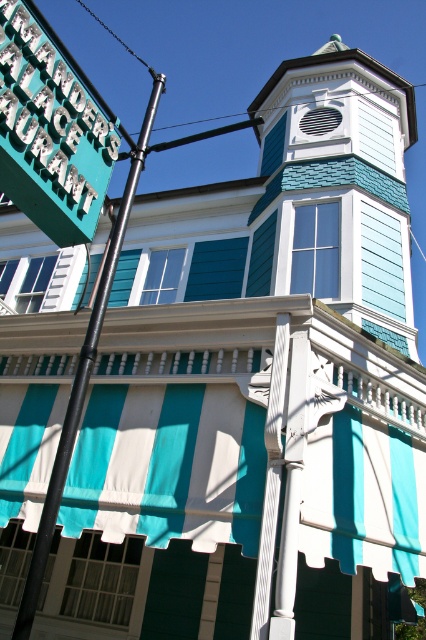
Which of these two, white shingled bell tower at upper center or black metal pole at left, stands shorter?

white shingled bell tower at upper center is shorter.

In order to click on white shingled bell tower at upper center in this screenshot , I will do `click(344, 180)`.

Does point (9, 13) come farther from viewer compared to point (118, 250)?

No, (9, 13) is closer to viewer.

Can you confirm if teal plastic sign at upper left is positioned to the left of black metal pole at left?

Incorrect, teal plastic sign at upper left is not on the left side of black metal pole at left.

Who is more distant from viewer, (32, 28) or (120, 204)?

Positioned behind is point (120, 204).

Locate an element on the screen. The width and height of the screenshot is (426, 640). teal plastic sign at upper left is located at coordinates (49, 132).

Is white shingled bell tower at upper center shorter than teal plastic sign at upper left?

No, white shingled bell tower at upper center is not shorter than teal plastic sign at upper left.

Is white shingled bell tower at upper center to the right of teal plastic sign at upper left from the viewer's perspective?

Yes, white shingled bell tower at upper center is to the right of teal plastic sign at upper left.

Find the location of a particular element. The image size is (426, 640). white shingled bell tower at upper center is located at coordinates (344, 180).